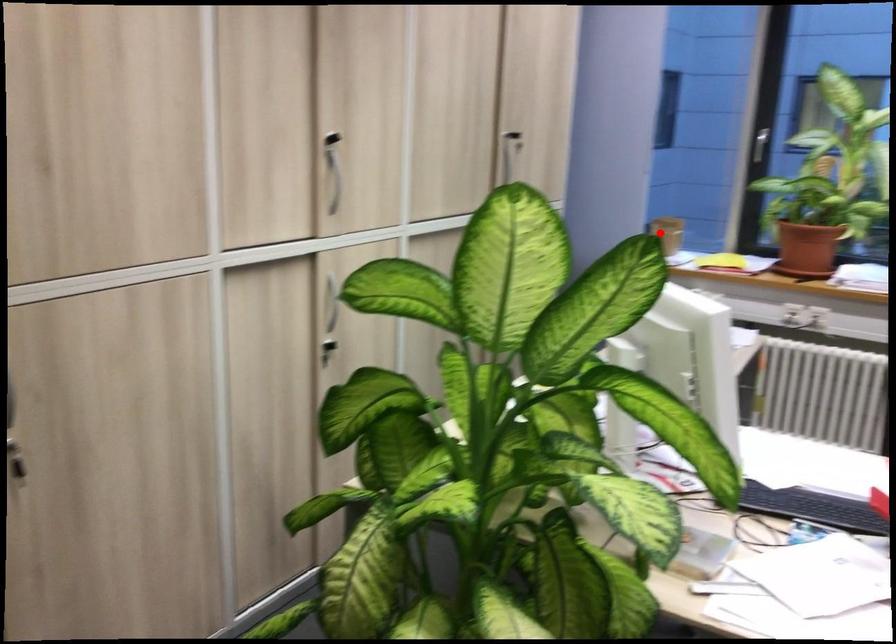
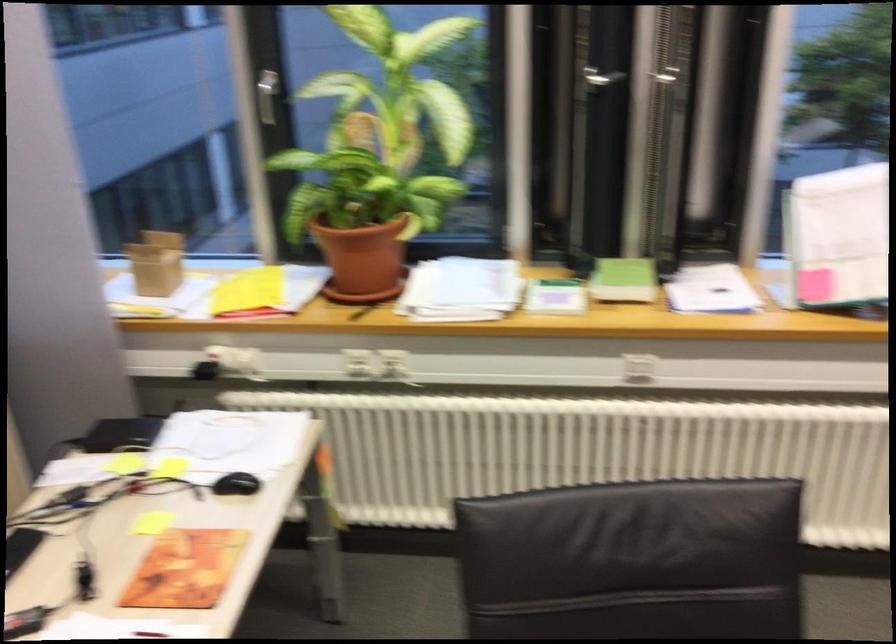
Question: A red point is marked in image1. In image2, is the corresponding 3D point closer to the camera or farther? Reply with the corresponding letter.

Choices:
 (A) The corresponding 3D point is closer.
 (B) The corresponding 3D point is farther.

Answer: (A)